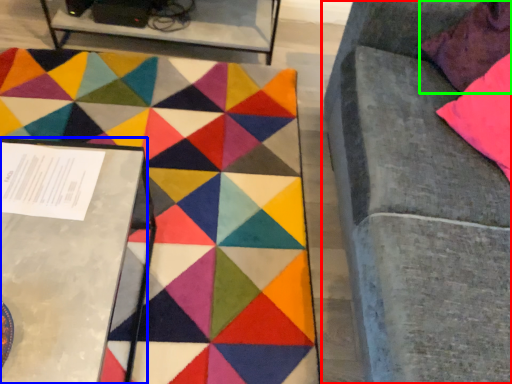
Question: Which is nearer to the furniture (highlighted by a red box)? table (highlighted by a blue box) or pillow (highlighted by a green box).

Choices:
 (A) table
 (B) pillow

Answer: (B)